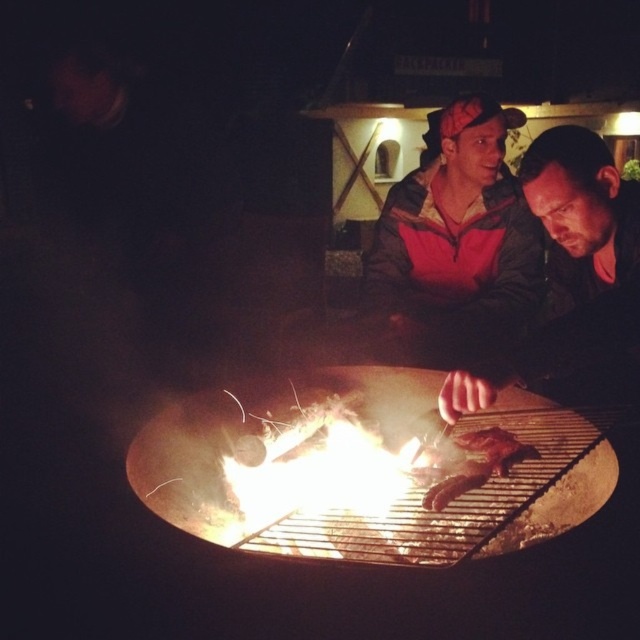
Question: Can you confirm if camouflage jacket at center is positioned to the left of charred wood at grill center?

Choices:
 (A) no
 (B) yes

Answer: (A)

Question: Which object is farther from the camera taking this photo?

Choices:
 (A) charred wood at grill center
 (B) camouflage jacket at center
 (C) matte black jacket at center

Answer: (B)

Question: Does camouflage jacket at center appear on the left side of matte black jacket at center?

Choices:
 (A) no
 (B) yes

Answer: (B)

Question: Considering the relative positions of camouflage jacket at center and charred wood at grill center in the image provided, where is camouflage jacket at center located with respect to charred wood at grill center?

Choices:
 (A) above
 (B) below

Answer: (A)

Question: Which point appears closest to the camera in this image?

Choices:
 (A) (468, 484)
 (B) (428, 196)

Answer: (A)

Question: Which of the following is the farthest from the observer?

Choices:
 (A) (492, 221)
 (B) (476, 456)
 (C) (582, 198)

Answer: (A)